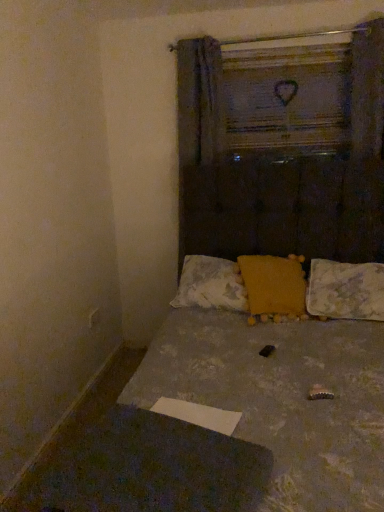
Question: Can you confirm if yellow fuzzy pillow at center, which ranks as the 2th pillow in left-to-right order, is positioned to the left of wooden frame at upper center?

Choices:
 (A) no
 (B) yes

Answer: (B)

Question: Is yellow fuzzy pillow at center, which ranks as the second pillow in right-to-left order, not within wooden frame at upper center?

Choices:
 (A) yes
 (B) no

Answer: (A)

Question: From a real-world perspective, is yellow fuzzy pillow at center, which ranks as the second pillow in right-to-left order, below wooden frame at upper center?

Choices:
 (A) yes
 (B) no

Answer: (A)

Question: From a real-world perspective, is yellow fuzzy pillow at center, which ranks as the second pillow in right-to-left order, physically above wooden frame at upper center?

Choices:
 (A) no
 (B) yes

Answer: (A)

Question: Considering the relative sizes of yellow fuzzy pillow at center, which ranks as the 2th pillow in left-to-right order, and wooden frame at upper center in the image provided, is yellow fuzzy pillow at center, which ranks as the 2th pillow in left-to-right order, smaller than wooden frame at upper center?

Choices:
 (A) yes
 (B) no

Answer: (B)

Question: Is yellow fuzzy pillow at center, which ranks as the second pillow in right-to-left order, further to the viewer compared to wooden frame at upper center?

Choices:
 (A) yes
 (B) no

Answer: (B)

Question: Can you confirm if yellow fabric pillow at center, placed as the 3th pillow when sorted from right to left, is smaller than fluffy white pillow at lower right, placed as the third pillow when sorted from left to right?

Choices:
 (A) yes
 (B) no

Answer: (B)

Question: Is yellow fabric pillow at center, which is counted as the 1th pillow, starting from the left, completely or partially outside of fluffy white pillow at lower right, placed as the third pillow when sorted from left to right?

Choices:
 (A) no
 (B) yes

Answer: (B)

Question: From the image's perspective, is yellow fabric pillow at center, placed as the 3th pillow when sorted from right to left, under fluffy white pillow at lower right, marked as the first pillow in a right-to-left arrangement?

Choices:
 (A) yes
 (B) no

Answer: (B)

Question: Considering the relative positions of yellow fabric pillow at center, placed as the 3th pillow when sorted from right to left, and fluffy white pillow at lower right, marked as the first pillow in a right-to-left arrangement, in the image provided, is yellow fabric pillow at center, placed as the 3th pillow when sorted from right to left, in front of fluffy white pillow at lower right, marked as the first pillow in a right-to-left arrangement,?

Choices:
 (A) yes
 (B) no

Answer: (B)

Question: Is yellow fabric pillow at center, which is counted as the 1th pillow, starting from the left, turned away from fluffy white pillow at lower right, marked as the first pillow in a right-to-left arrangement?

Choices:
 (A) no
 (B) yes

Answer: (A)

Question: Is yellow fabric pillow at center, placed as the 3th pillow when sorted from right to left, far away from fluffy white pillow at lower right, placed as the third pillow when sorted from left to right?

Choices:
 (A) no
 (B) yes

Answer: (A)

Question: Does yellow fabric pillow at center, which is counted as the 1th pillow, starting from the left, have a lesser width compared to yellow fuzzy pillow at center, which ranks as the 2th pillow in left-to-right order?

Choices:
 (A) no
 (B) yes

Answer: (B)